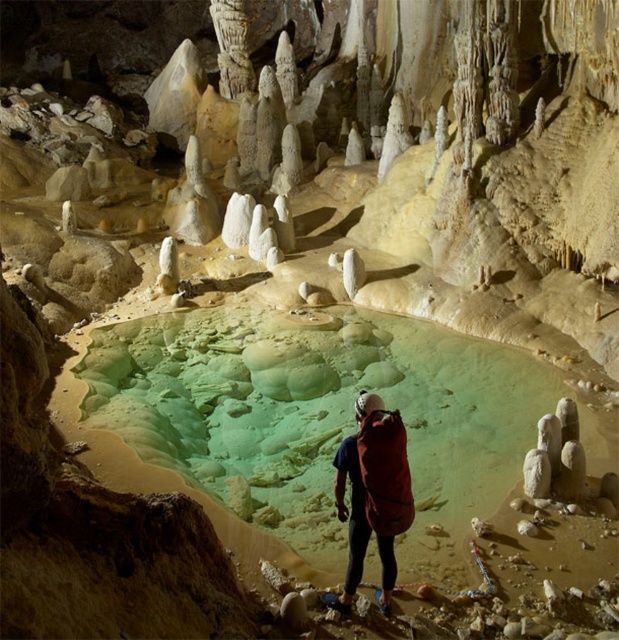
You are an explorer who just entered the cave and see the green translucent water at center and the matte orange backpack at center. Which object is positioned to the left of the other?

The matte orange backpack at center is to the left of the green translucent water at center because the green translucent water at center is to the right of the matte orange backpack at center.

You are an explorer inside the cave and want to retrieve your matte orange backpack at center. You are currently standing behind the green translucent water at center. Can you reach the backpack without moving past the water?

The matte orange backpack at center is behind the green translucent water at center, so you cannot reach it without moving past the water.

Based on the photo, you are a spelunker exploring the cave and want to place two markers at point [439,339] and point [386,432]. Which point is closer to you?

Point [439,339] is closer to you because it is further to the viewer than point [386,432].